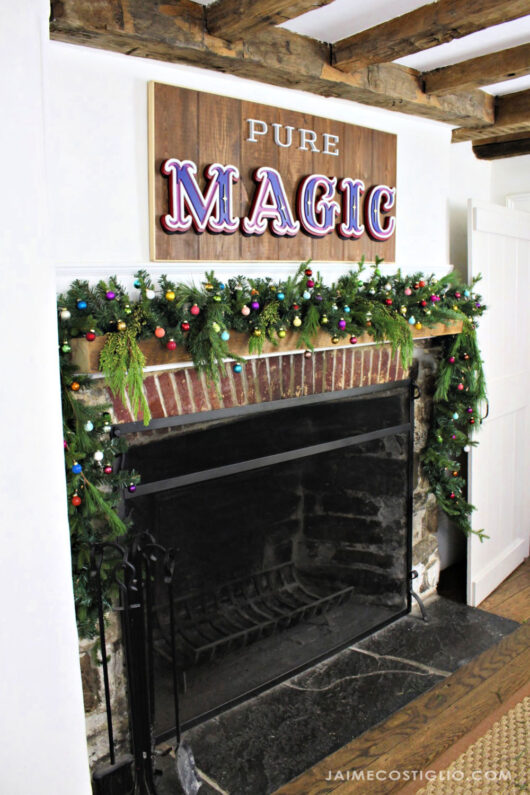
This screenshot has width=530, height=795. I want to click on plastic wreath decoration, so click(81, 525), click(82, 421), click(89, 308), click(203, 312), click(312, 305), click(401, 297), click(472, 291), click(466, 375), click(449, 464).